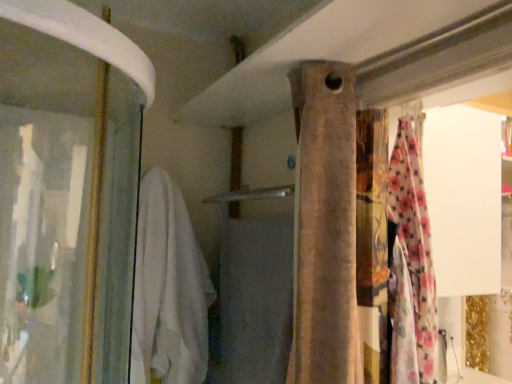
Question: From their relative heights in the image, would you say white soft towel at left is taller or shorter than beige fabric curtain at center?

Choices:
 (A) tall
 (B) short

Answer: (A)

Question: Do you think white soft towel at left is within beige fabric curtain at center, or outside of it?

Choices:
 (A) outside
 (B) inside

Answer: (A)

Question: Estimate the real-world distances between objects in this image. Which object is closer to the beige fabric curtain at center?

Choices:
 (A) white soft towel at center
 (B) white soft towel at left

Answer: (A)

Question: Which is farther from the beige fabric curtain at center?

Choices:
 (A) white soft towel at center
 (B) white soft towel at left

Answer: (B)